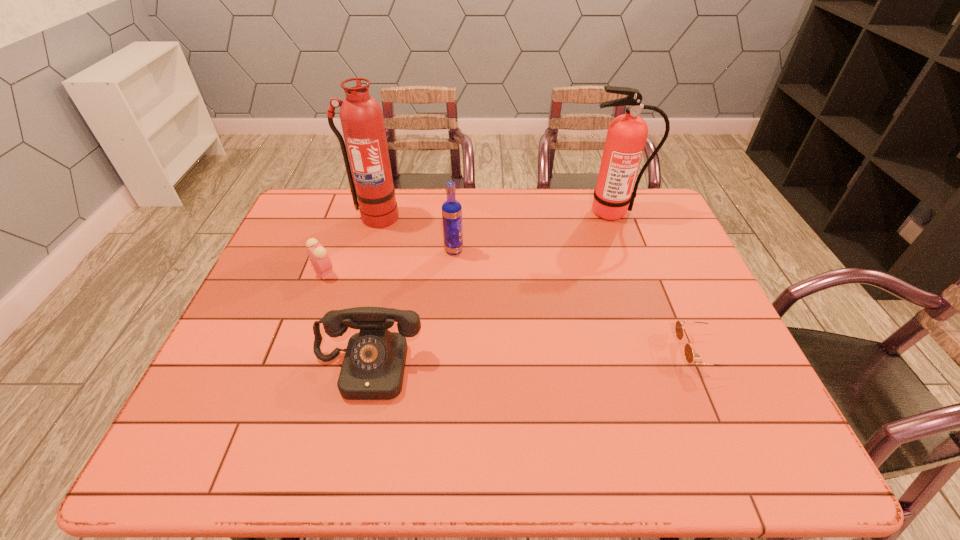
Locate an element on the screen. free point between the second shortest object and the third tallest object is located at coordinates (389, 261).

Find the location of a particular element. Image resolution: width=960 pixels, height=540 pixels. vacant space in between the third farthest object and the telephone is located at coordinates (411, 309).

Locate an element on the screen. The height and width of the screenshot is (540, 960). vacant area that lies between the sunglasses and the third shortest object is located at coordinates (535, 360).

Identify the location of free area in between the telephone and the sunglasses. (535, 360).

Locate an element on the screen. Image resolution: width=960 pixels, height=540 pixels. free space between the sunglasses and the left fire extinguisher is located at coordinates (539, 285).

Select which object is the second closest to the fourth shortest object. Please provide its 2D coordinates. Your answer should be formatted as a tuple, i.e. [(x, y)], where the tuple contains the x and y coordinates of a point satisfying the conditions above.

[(317, 254)]

At what (x,y) coordinates should I click in order to perform the action: click on object that is the closest to the third farthest object. Please return your answer as a coordinate pair (x, y). Looking at the image, I should click on (361, 116).

At what (x,y) coordinates should I click in order to perform the action: click on vacant space that satisfies the following two spatial constraints: 1. on the front lenses of the shortest object; 2. on the dial of the telephone. Please return your answer as a coordinate pair (x, y). The height and width of the screenshot is (540, 960). Looking at the image, I should click on (708, 369).

The height and width of the screenshot is (540, 960). What are the coordinates of `free space that satisfies the following two spatial constraints: 1. on the label side of the left fire extinguisher; 2. on the right side of the vodka` in the screenshot? It's located at (366, 251).